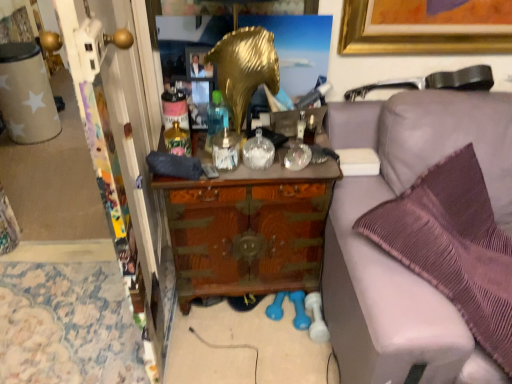
The height and width of the screenshot is (384, 512). Identify the location of vacant area on the back side of matte gray remote control at center. (198, 145).